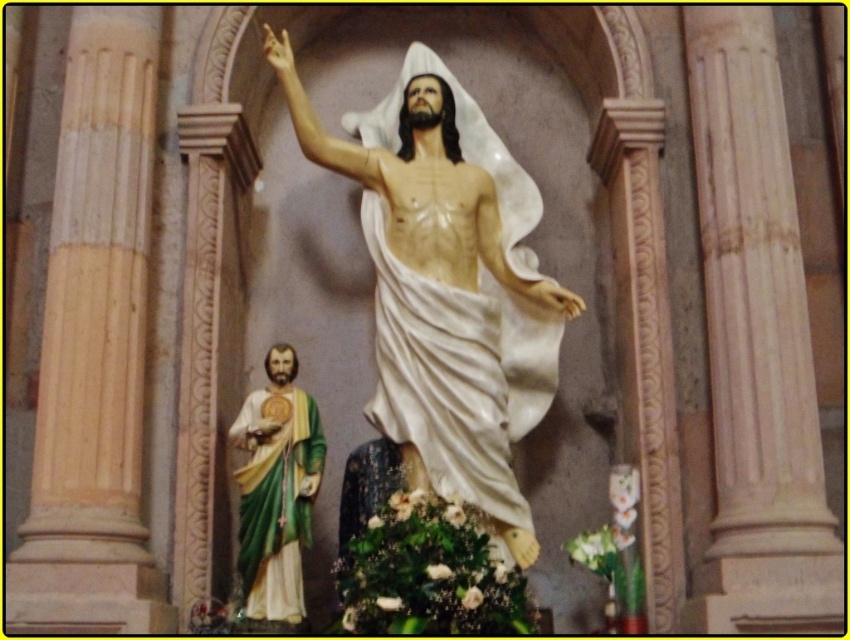
Which is more to the left, white marble statue at center or green painted wood statue at left?

From the viewer's perspective, green painted wood statue at left appears more on the left side.

Does white marble statue at center have a smaller size compared to green painted wood statue at left?

Incorrect, white marble statue at center is not smaller in size than green painted wood statue at left.

In order to click on white marble statue at center in this screenshot , I will do `click(446, 284)`.